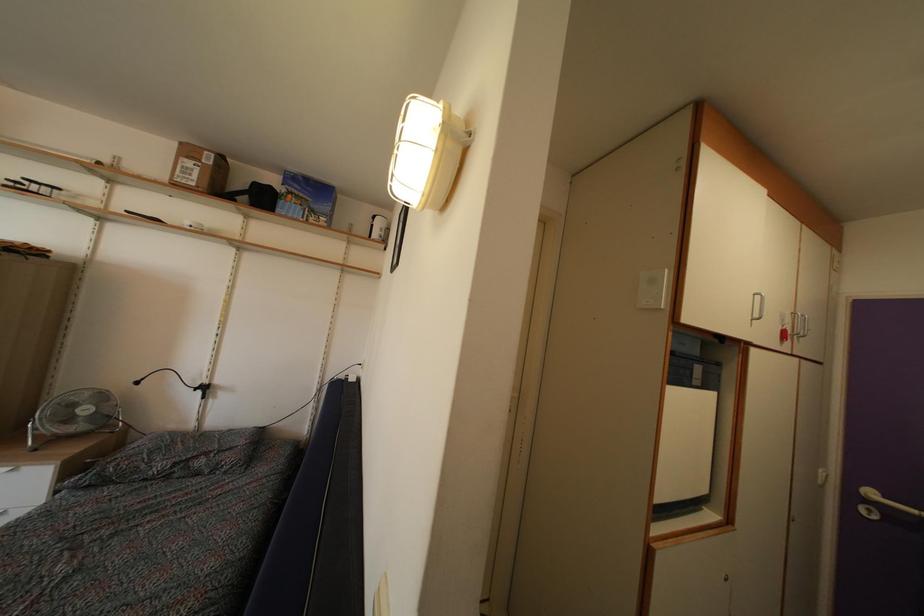
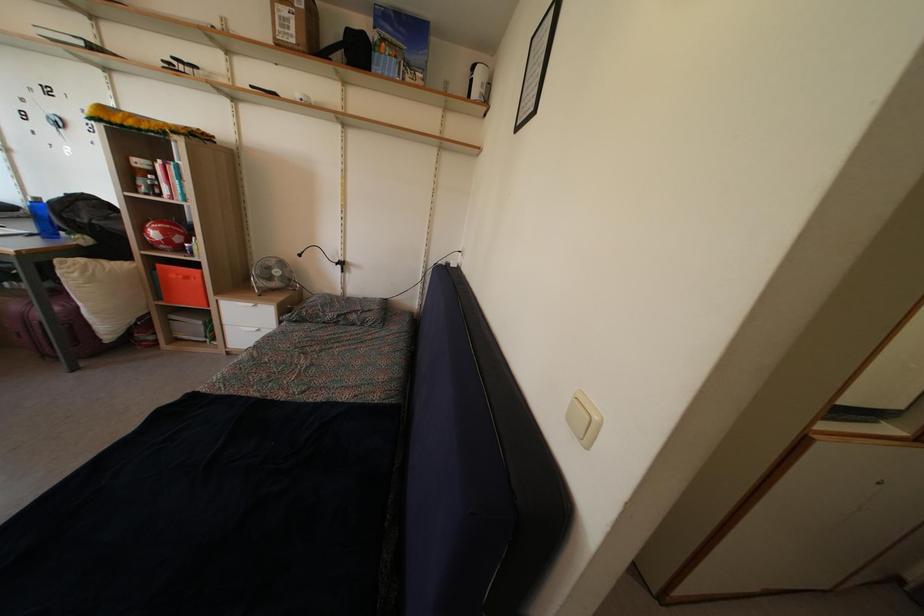
Where in the second image is the point corresponding to (x=89, y=419) from the first image?

(280, 281)